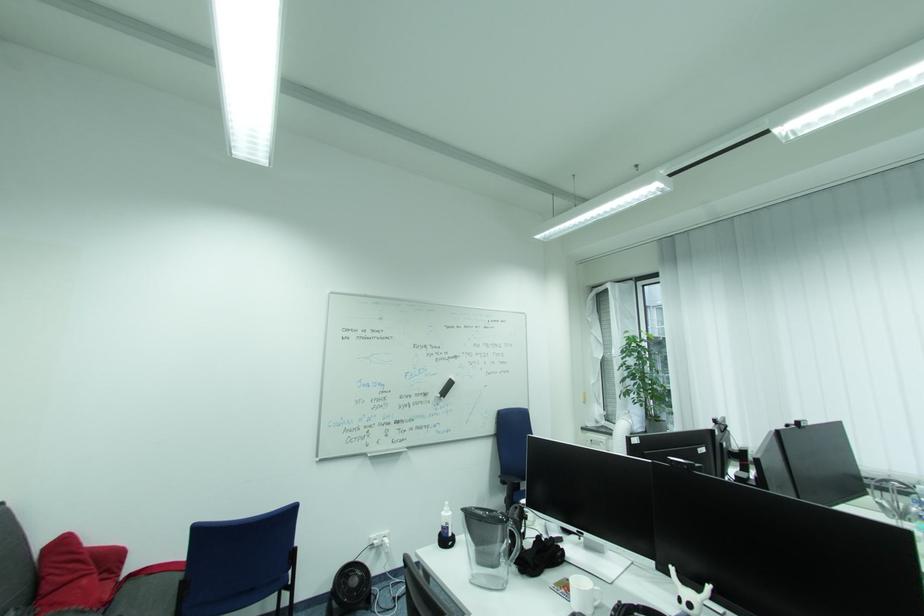
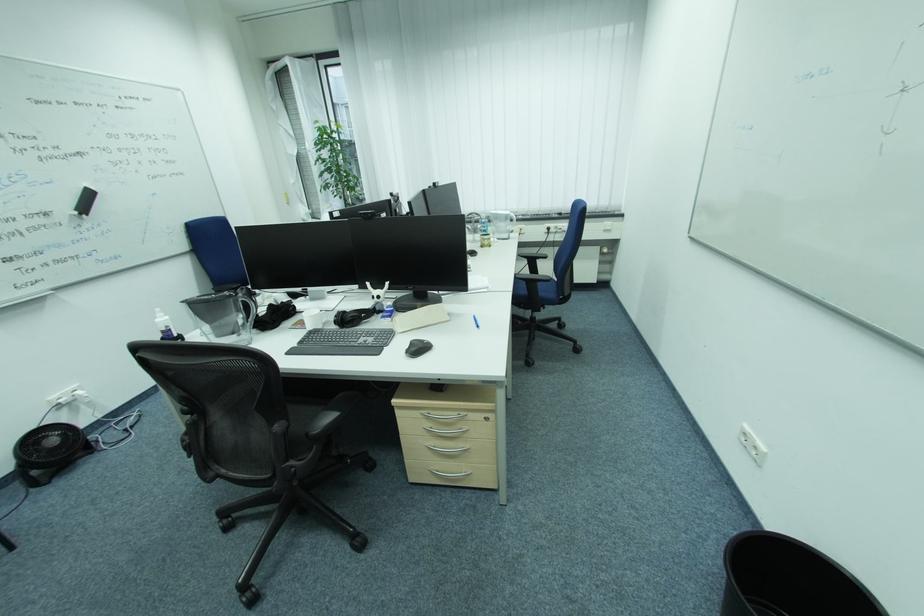
The point at (515, 523) is marked in the first image. Where is the corresponding point in the second image?

(242, 294)